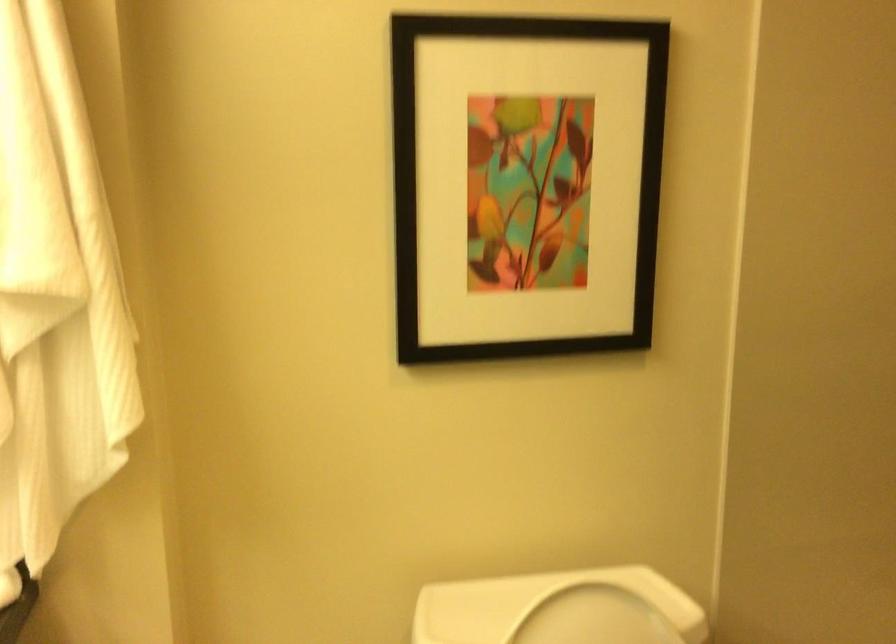
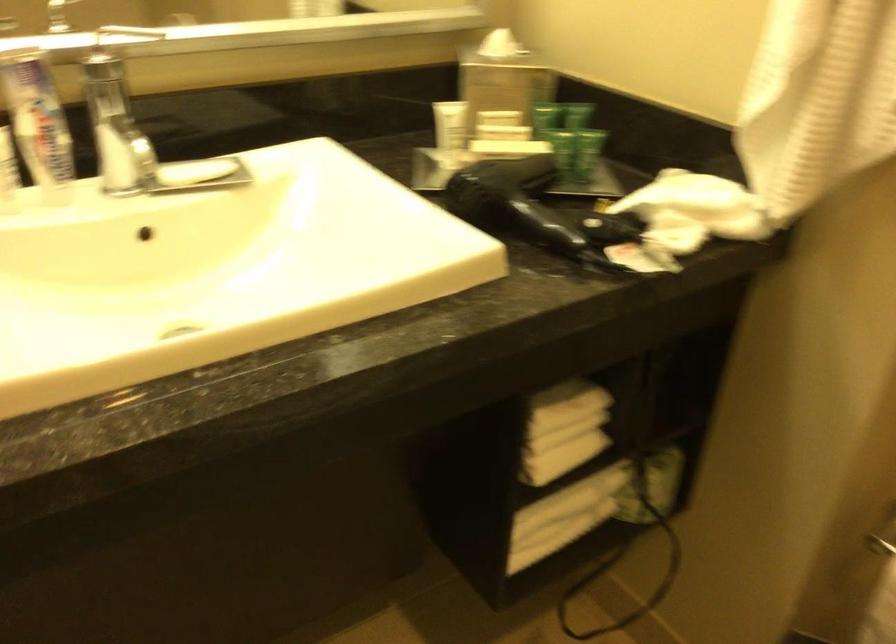
Based on the photo, the images are taken continuously from a first-person perspective. In which direction is your viewpoint rotating?

The camera rotated toward left-down.